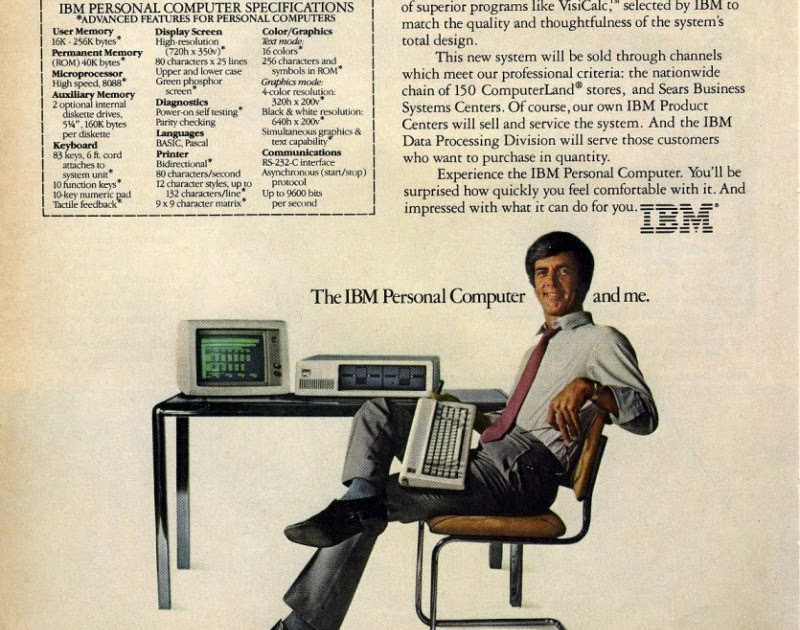
Locate an element on the screen. Image resolution: width=800 pixels, height=630 pixels. keyboard is located at coordinates (438, 443).